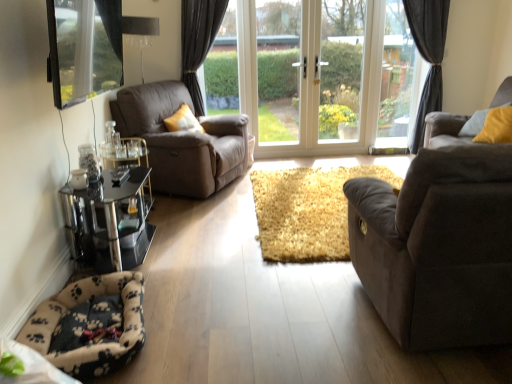
Where is `vacant area located to the right-hand side of black glass table at lower left`? vacant area located to the right-hand side of black glass table at lower left is located at coordinates (199, 259).